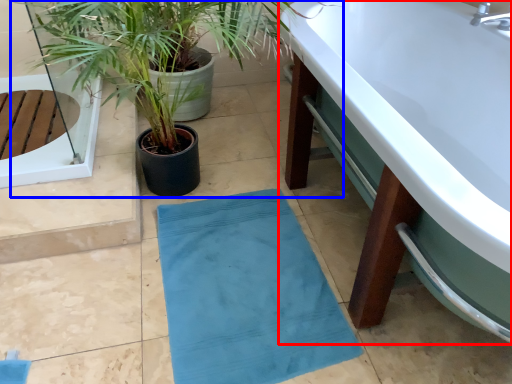
Question: Which of the following is the farthest to the observer, bathtub (highlighted by a red box) or houseplant (highlighted by a blue box)?

Choices:
 (A) bathtub
 (B) houseplant

Answer: (B)